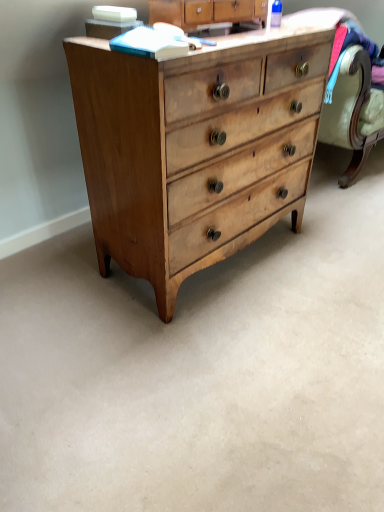
What are the coordinates of `free spot to the left of light brown wood chest of drawers at center` in the screenshot? It's located at (56, 280).